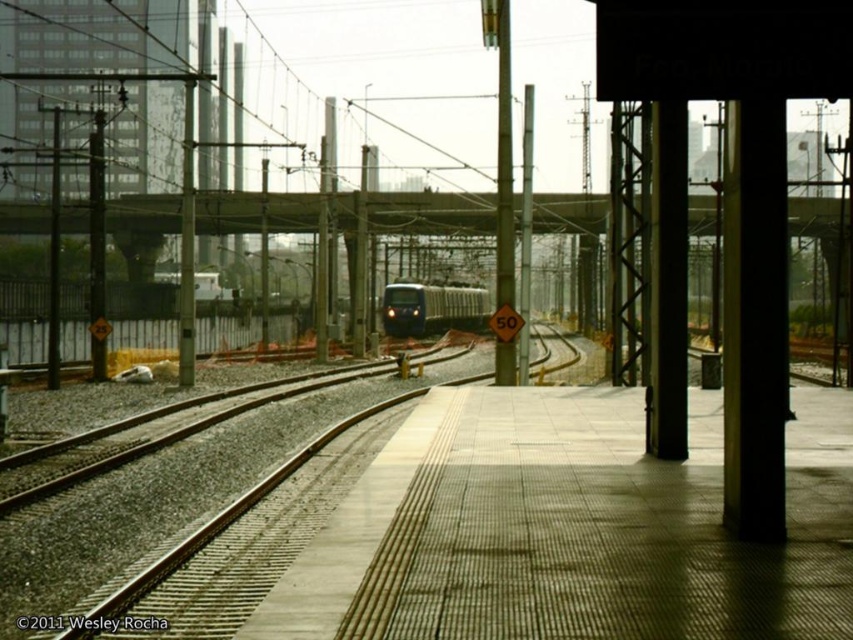
You are standing on the platform and want to take a photo of both the point at coordinates point (204,577) and point (488,307). Which point should you focus on first to ensure both are in focus?

You should focus on point (204,577) first because it is closer to the camera than point (488,307), ensuring both will be in focus when using depth of field.

You are a safety inspector at the railway station. You need to ensure that the blue glossy train at center is at least 100 feet away from the smooth concrete train track at center for safety regulations. Based on the image, is the current distance compliant with the safety requirement?

The distance between the smooth concrete train track at center and the blue glossy train at center is 108.21 feet, which exceeds the required 100 feet, so it is compliant with the safety regulations.